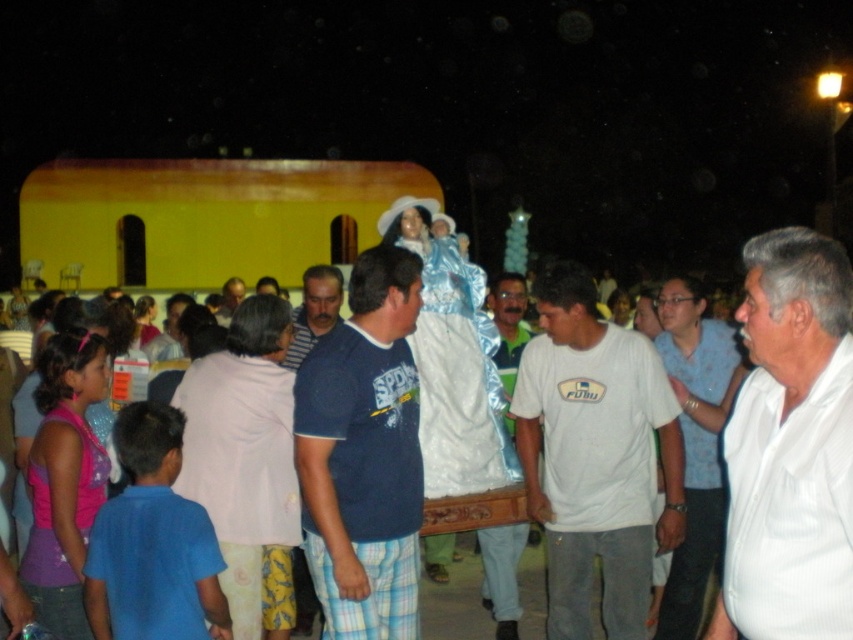
Question: Which object appears farthest from the camera in this image?

Choices:
 (A) white cotton t-shirt at center
 (B) dark blue shirt at center
 (C) blue cotton shirt at center
 (D) white matte t-shirt at center

Answer: (B)

Question: Considering the real-world distances, which object is farthest from the white matte t-shirt at center?

Choices:
 (A) white cotton shirt at center
 (B) white smooth shirt at right

Answer: (B)

Question: Is blue cotton shirt at center to the left of white matte t-shirt at center from the viewer's perspective?

Choices:
 (A) no
 (B) yes

Answer: (B)

Question: Which point is farther to the camera?

Choices:
 (A) dark blue shirt at center
 (B) white cotton shirt at center

Answer: (A)

Question: Does white cotton t-shirt at center appear on the right side of blue cotton shirt at center?

Choices:
 (A) no
 (B) yes

Answer: (B)

Question: In this image, where is white smooth shirt at right located relative to dark blue shirt at center?

Choices:
 (A) below
 (B) above

Answer: (A)